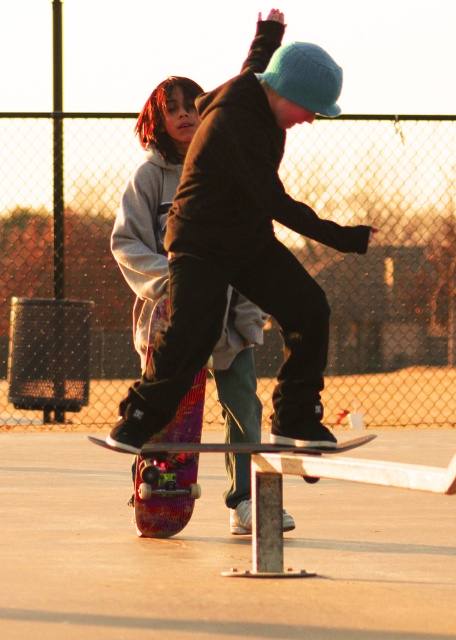
You are a photographer at the skatepark and want to capture both the multicolored wooden skateboard at center and the multicolored glossy skateboard at center in a single shot. Which skateboard should you focus on to ensure both are in frame without moving the camera?

The multicolored glossy skateboard at center is behind the multicolored wooden skateboard at center, so focusing on the multicolored wooden skateboard at center will keep both in frame as the glossy one is behind it.

You are a photographer trying to capture the skateboarder on the multicolored wooden skateboard at center. If you want to focus on the skateboard, where should you aim your camera? Please provide the coordinates as a point in the format of a tuple with two decimals.

The multicolored wooden skateboard at center is located at point [245,241], so you should aim your camera at the coordinates approximately at the point of [246,243].